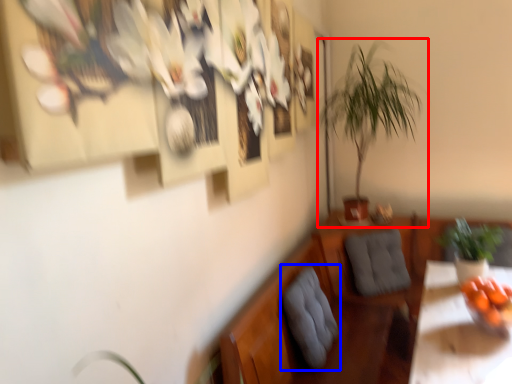
Question: Which point is closer to the camera, houseplant (highlighted by a red box) or swivel chair (highlighted by a blue box)?

Choices:
 (A) houseplant
 (B) swivel chair

Answer: (B)